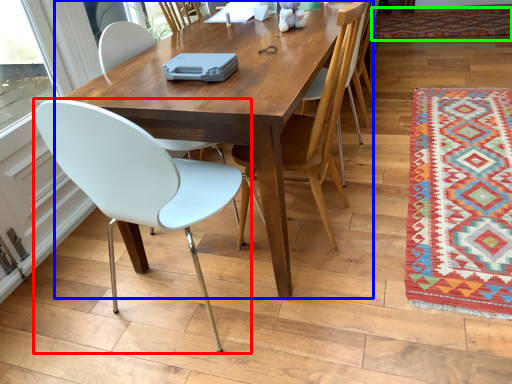
Question: Which object is the closest to the chair (highlighted by a red box)? Choose among these: kitchen & dining room table (highlighted by a blue box) or mat (highlighted by a green box).

Choices:
 (A) kitchen & dining room table
 (B) mat

Answer: (A)